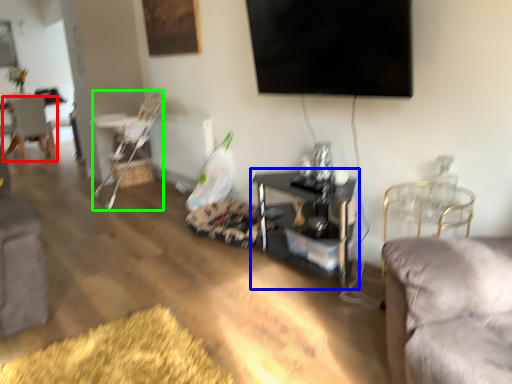
Question: Estimate the real-world distances between objects in this image. Which object is closer to chair (highlighted by a red box), table (highlighted by a blue box) or chair (highlighted by a green box)?

Choices:
 (A) table
 (B) chair

Answer: (B)